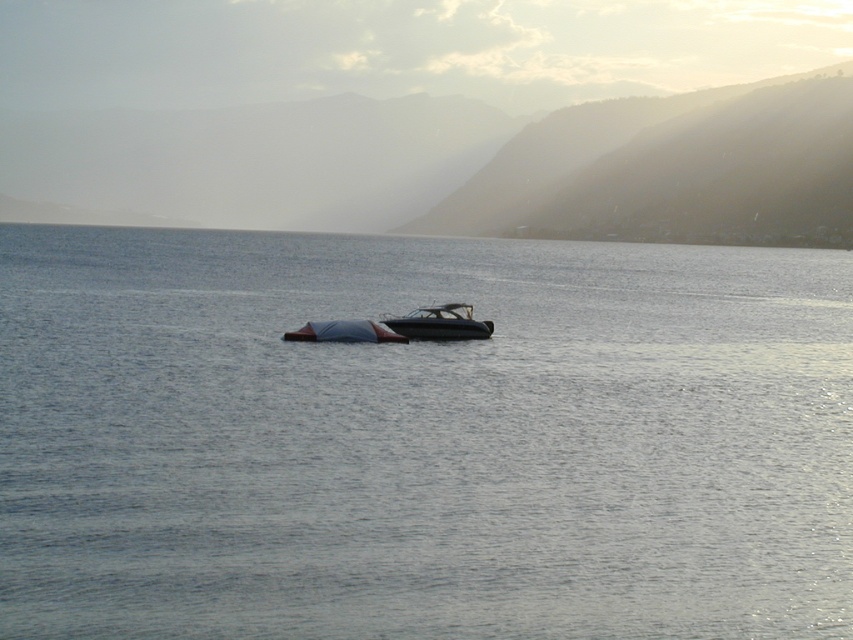
Is clear water at center further to the viewer compared to shiny blue boat at center?

No, clear water at center is closer to the viewer.

Can you confirm if clear water at center is positioned to the right of shiny blue boat at center?

Yes, clear water at center is to the right of shiny blue boat at center.

Identify the location of clear water at center. This screenshot has height=640, width=853. (421, 440).

The height and width of the screenshot is (640, 853). Find the location of `clear water at center`. clear water at center is located at coordinates (421, 440).

Which is more to the right, glossy black boat at center or shiny blue boat at center?

glossy black boat at center

Describe the element at coordinates (439, 323) in the screenshot. This screenshot has width=853, height=640. I see `glossy black boat at center` at that location.

Where is `glossy black boat at center`? This screenshot has height=640, width=853. glossy black boat at center is located at coordinates (439, 323).

Between clear water at center and glossy black boat at center, which one is positioned lower?

glossy black boat at center

Is point (497, 620) closer to camera compared to point (461, 317)?

Yes, point (497, 620) is closer to viewer.

At what (x,y) coordinates should I click in order to perform the action: click on clear water at center. Please return your answer as a coordinate pair (x, y). The image size is (853, 640). Looking at the image, I should click on (421, 440).